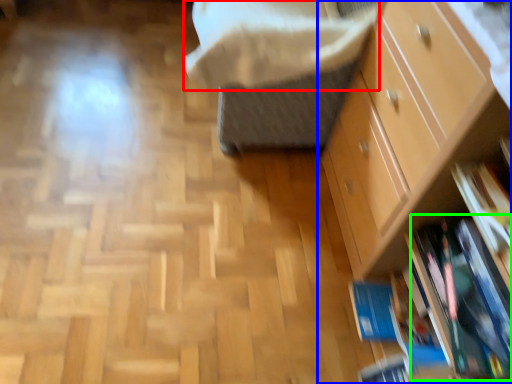
Question: Which object is the farthest from blanket (highlighted by a red box)? Choose among these: chest of drawers (highlighted by a blue box) or book (highlighted by a green box).

Choices:
 (A) chest of drawers
 (B) book

Answer: (B)